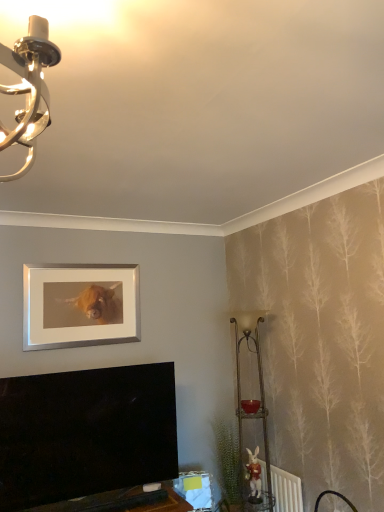
Question: Do you think silver/metallic picture frame at upper center is within metallic gold table lamp at right, or outside of it?

Choices:
 (A) inside
 (B) outside

Answer: (B)

Question: Considering their positions, is silver/metallic picture frame at upper center located in front of or behind metallic gold table lamp at right?

Choices:
 (A) front
 (B) behind

Answer: (B)

Question: Which object is positioned farthest from the silver/metallic picture frame at upper center?

Choices:
 (A) white plastic radiator at lower right
 (B) green leafy plant at lower right
 (C) metallic gold table lamp at right

Answer: (A)

Question: Which object is positioned farthest from the metallic gold table lamp at right?

Choices:
 (A) white plastic radiator at lower right
 (B) green leafy plant at lower right
 (C) silver/metallic picture frame at upper center

Answer: (C)